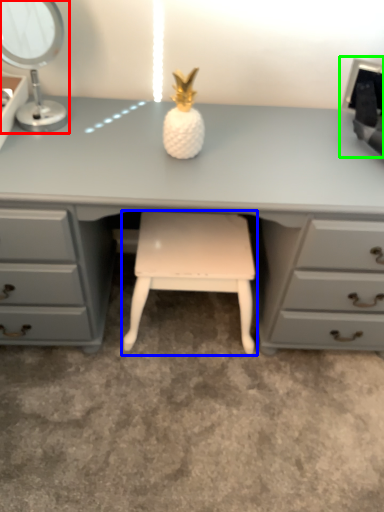
Question: Which object is positioned closest to table lamp (highlighted by a red box)? Select from stool (highlighted by a blue box) and desktop computer (highlighted by a green box).

Choices:
 (A) stool
 (B) desktop computer

Answer: (A)